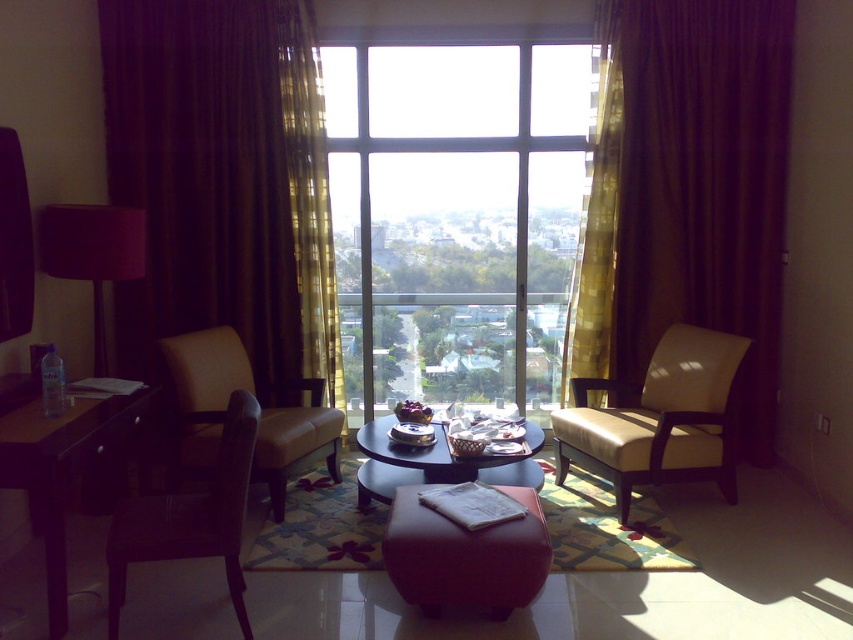
You are a guest in this hotel room and want to place a tall potted plant on the brown leather armchair at left or the matte black lampshade at left. Based on their heights, which object can support the plant without it toppling over?

The brown leather armchair at left has a greater height compared to the matte black lampshade at left, so it can support the tall potted plant without it toppling over.